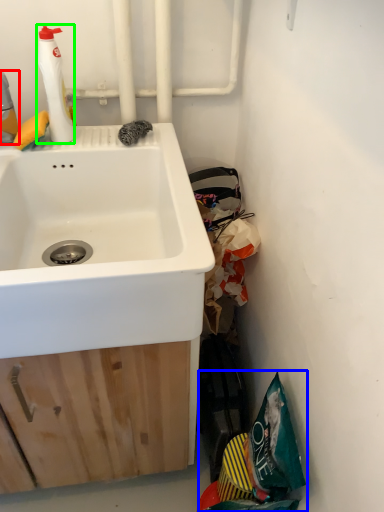
Question: Which object is positioned farthest from cleaning product (highlighted by a red box)? Select from garbage (highlighted by a blue box) and cleaning product (highlighted by a green box).

Choices:
 (A) garbage
 (B) cleaning product

Answer: (A)